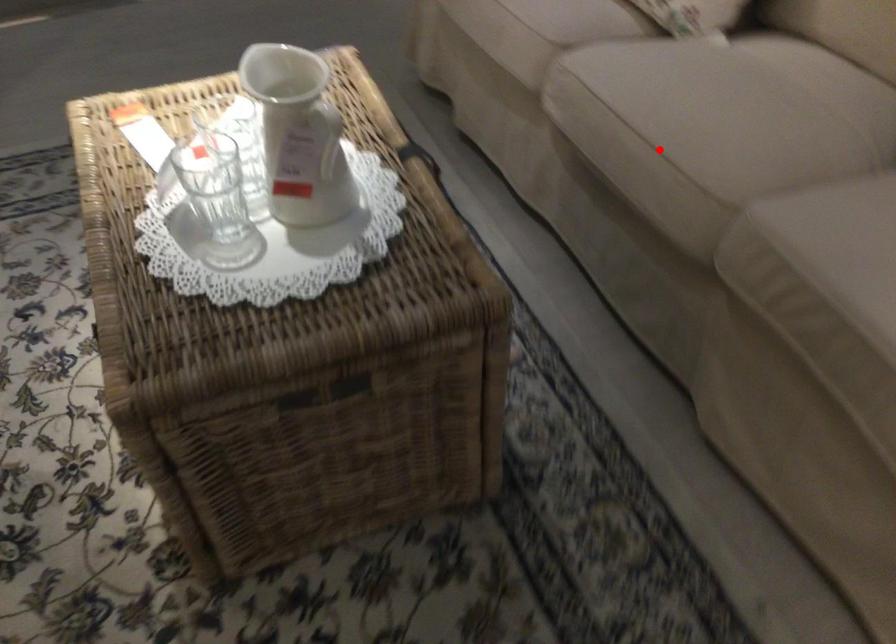
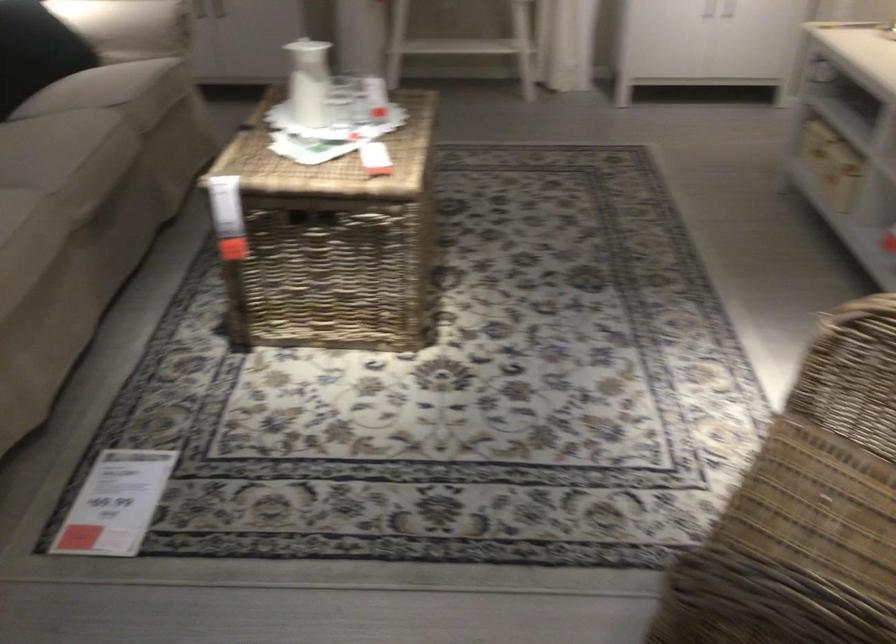
Question: I am providing you with two images of the same scene from different viewpoints. Given a red point in image1, look at the same physical point in image2. Is it:

Choices:
 (A) Closer to the viewpoint
 (B) Farther from the viewpoint

Answer: (B)